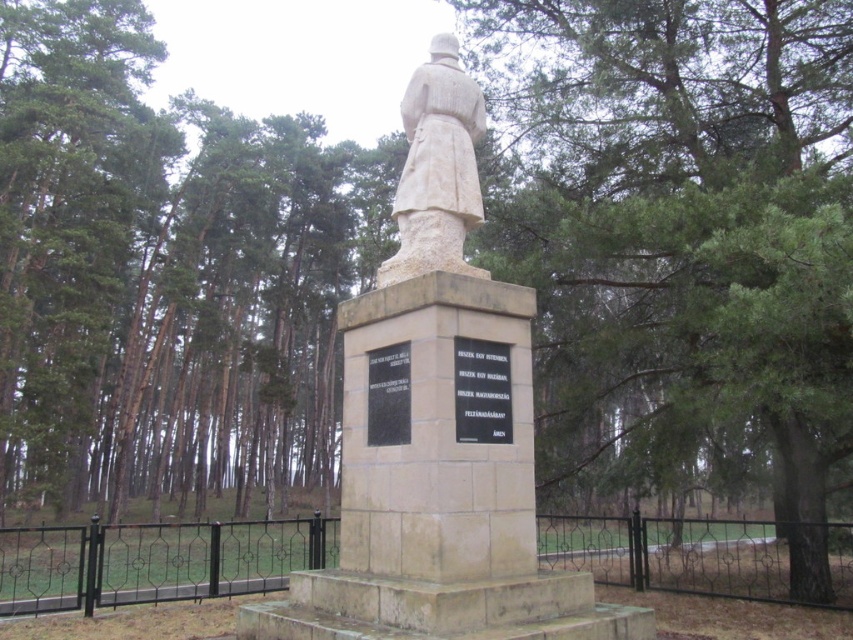
Question: Does black wrought iron fence at lower center come behind black stone plaque at center?

Choices:
 (A) no
 (B) yes

Answer: (B)

Question: In this image, where is green leafy tree at center located relative to black wrought iron fence at lower center?

Choices:
 (A) below
 (B) above

Answer: (B)

Question: Which point is farther to the camera?

Choices:
 (A) (332, 547)
 (B) (498, 378)

Answer: (A)

Question: Does green leafy tree at center appear on the left side of black polished stone plaque at center?

Choices:
 (A) yes
 (B) no

Answer: (B)

Question: Among these points, which one is nearest to the camera?

Choices:
 (A) click(x=257, y=548)
 (B) click(x=399, y=392)

Answer: (B)

Question: Which object appears closest to the camera in this image?

Choices:
 (A) black wrought iron fence at lower center
 (B) green leafy tree at center
 (C) black polished stone plaque at center

Answer: (C)